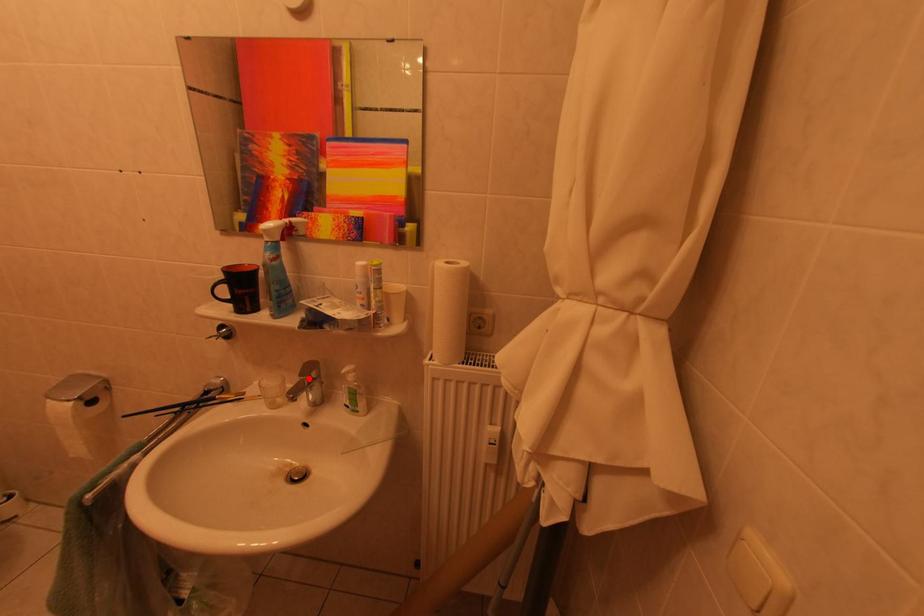
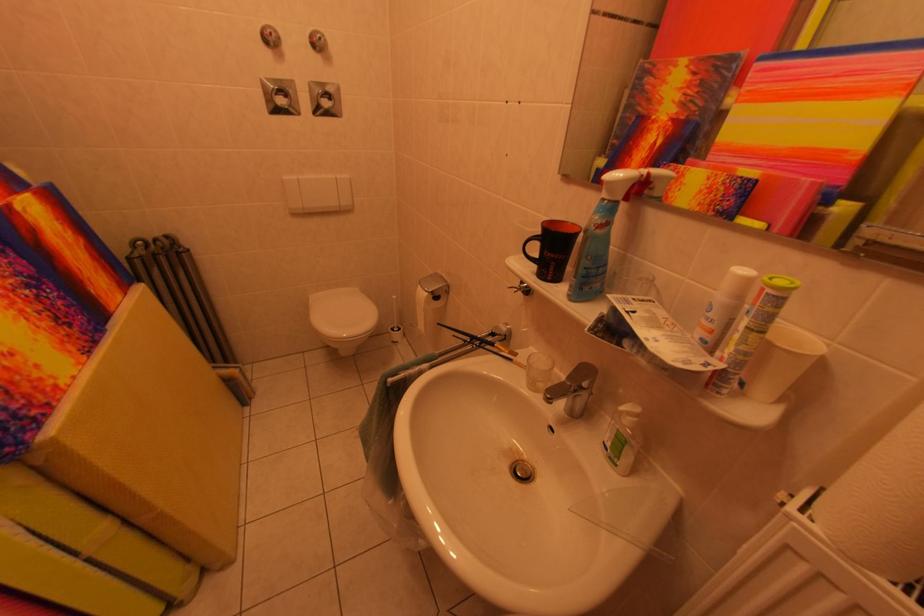
Find the pixel in the second image that matches the highlighted location in the first image.

(578, 382)